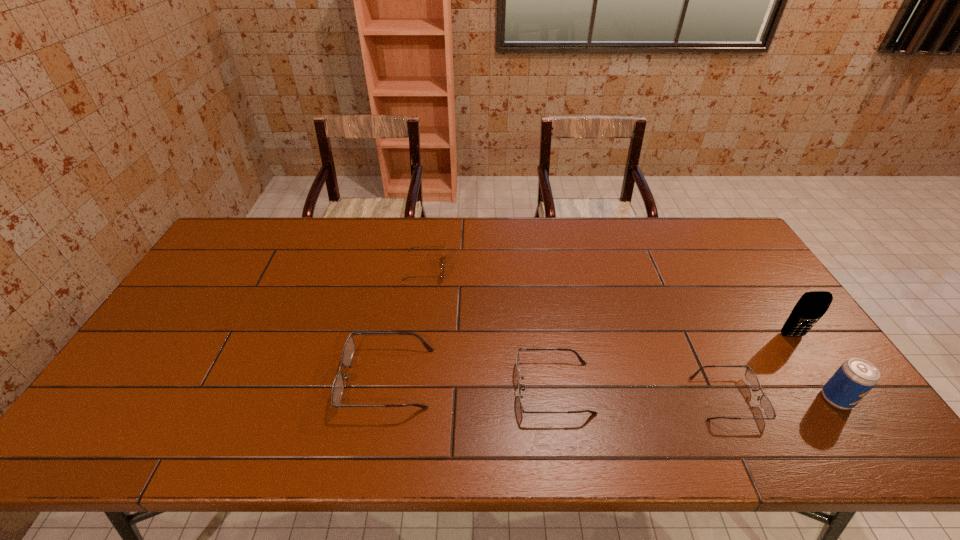
Please point a vacant point for placing a spectacles on the left. Please provide its 2D coordinates. Your answer should be formatted as a tuple, i.e. [(x, y)], where the tuple contains the x and y coordinates of a point satisfying the conditions above.

[(227, 369)]